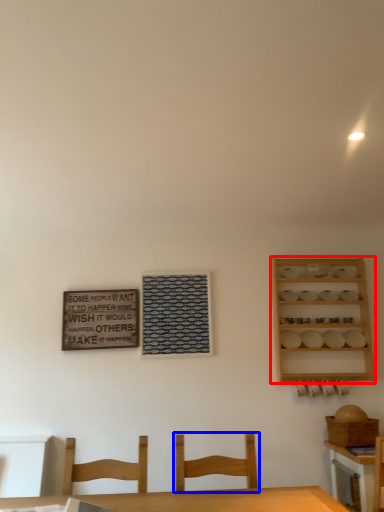
Question: Which of the following is the farthest to the observer, shelf (highlighted by a red box) or chair (highlighted by a blue box)?

Choices:
 (A) shelf
 (B) chair

Answer: (A)